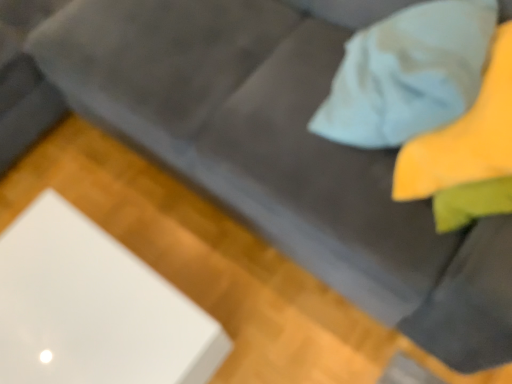
Describe the element at coordinates (93, 308) in the screenshot. Image resolution: width=512 pixels, height=384 pixels. I see `white glossy cube at lower left` at that location.

This screenshot has width=512, height=384. What are the coordinates of `white glossy cube at lower left` in the screenshot? It's located at (93, 308).

I want to click on yellow fabric pillow at upper right, so click(x=408, y=74).

What do you see at coordinates (408, 74) in the screenshot? Image resolution: width=512 pixels, height=384 pixels. I see `yellow fabric pillow at upper right` at bounding box center [408, 74].

Consider the image. What is the approximate width of yellow fabric pillow at upper right?

yellow fabric pillow at upper right is 15.68 inches in width.

I want to click on white glossy cube at lower left, so click(93, 308).

Which is more to the left, white glossy cube at lower left or yellow fabric pillow at upper right?

white glossy cube at lower left is more to the left.

Relative to yellow fabric pillow at upper right, is white glossy cube at lower left in front or behind?

In the image, white glossy cube at lower left appears behind yellow fabric pillow at upper right.

Is point (219, 355) closer or farther from the camera than point (351, 132)?

Clearly, point (219, 355) is more distant from the camera than point (351, 132).

From the image's perspective, is white glossy cube at lower left on top of yellow fabric pillow at upper right?

No, from the image's perspective, white glossy cube at lower left is not above yellow fabric pillow at upper right.

From a real-world perspective, which is physically above, white glossy cube at lower left or yellow fabric pillow at upper right?

yellow fabric pillow at upper right is physically above.

Considering the sizes of white glossy cube at lower left and yellow fabric pillow at upper right in the image, is white glossy cube at lower left wider or thinner than yellow fabric pillow at upper right?

white glossy cube at lower left is wider than yellow fabric pillow at upper right.

Does white glossy cube at lower left have a greater height compared to yellow fabric pillow at upper right?

Yes, white glossy cube at lower left is taller than yellow fabric pillow at upper right.

Can you confirm if white glossy cube at lower left is bigger than yellow fabric pillow at upper right?

Indeed, white glossy cube at lower left has a larger size compared to yellow fabric pillow at upper right.

From the picture: Is yellow fabric pillow at upper right completely or partially inside white glossy cube at lower left?

No, yellow fabric pillow at upper right is not inside white glossy cube at lower left.

Looking at this image, can you see white glossy cube at lower left touching yellow fabric pillow at upper right?

No.

Is white glossy cube at lower left looking in the opposite direction of yellow fabric pillow at upper right?

No.

Can you tell me how much white glossy cube at lower left and yellow fabric pillow at upper right differ in facing direction?

The facing directions of white glossy cube at lower left and yellow fabric pillow at upper right are 179 degrees apart.

From the picture: Measure the distance from white glossy cube at lower left to yellow fabric pillow at upper right.

white glossy cube at lower left is 70.42 centimeters away from yellow fabric pillow at upper right.

Find the location of a particular element. Image resolution: width=512 pixels, height=384 pixels. computer behind the yellow fabric pillow at upper right is located at coordinates (93, 308).

Is yellow fabric pillow at upper right at the right side of white glossy cube at lower left?

Yes.

Is the depth of yellow fabric pillow at upper right less than that of white glossy cube at lower left?

Yes.

Considering the points (438, 113) and (140, 364), which point is behind, point (438, 113) or point (140, 364)?

Positioned behind is point (140, 364).

From the image's perspective, does yellow fabric pillow at upper right appear higher than white glossy cube at lower left?

Correct, yellow fabric pillow at upper right appears higher than white glossy cube at lower left in the image.

From a real-world perspective, between yellow fabric pillow at upper right and white glossy cube at lower left, who is vertically higher?

In real-world perspective, yellow fabric pillow at upper right is above.

Considering the sizes of objects yellow fabric pillow at upper right and white glossy cube at lower left in the image provided, who is wider, yellow fabric pillow at upper right or white glossy cube at lower left?

white glossy cube at lower left is wider.

Does yellow fabric pillow at upper right have a lesser height compared to white glossy cube at lower left?

Correct, yellow fabric pillow at upper right is not as tall as white glossy cube at lower left.

Who is smaller, yellow fabric pillow at upper right or white glossy cube at lower left?

yellow fabric pillow at upper right is smaller.

Is yellow fabric pillow at upper right positioned beyond the bounds of white glossy cube at lower left?

yellow fabric pillow at upper right is positioned outside white glossy cube at lower left.

Does yellow fabric pillow at upper right touch white glossy cube at lower left?

No, yellow fabric pillow at upper right is not in contact with white glossy cube at lower left.

Could you tell me if yellow fabric pillow at upper right is turned towards white glossy cube at lower left?

No, yellow fabric pillow at upper right is not aimed at white glossy cube at lower left.

The width and height of the screenshot is (512, 384). I want to click on computer behind the yellow fabric pillow at upper right, so tap(93, 308).

The width and height of the screenshot is (512, 384). I want to click on throw pillow that appears above the white glossy cube at lower left (from the image's perspective), so click(408, 74).

Identify the location of throw pillow on the right of white glossy cube at lower left. The width and height of the screenshot is (512, 384). (408, 74).